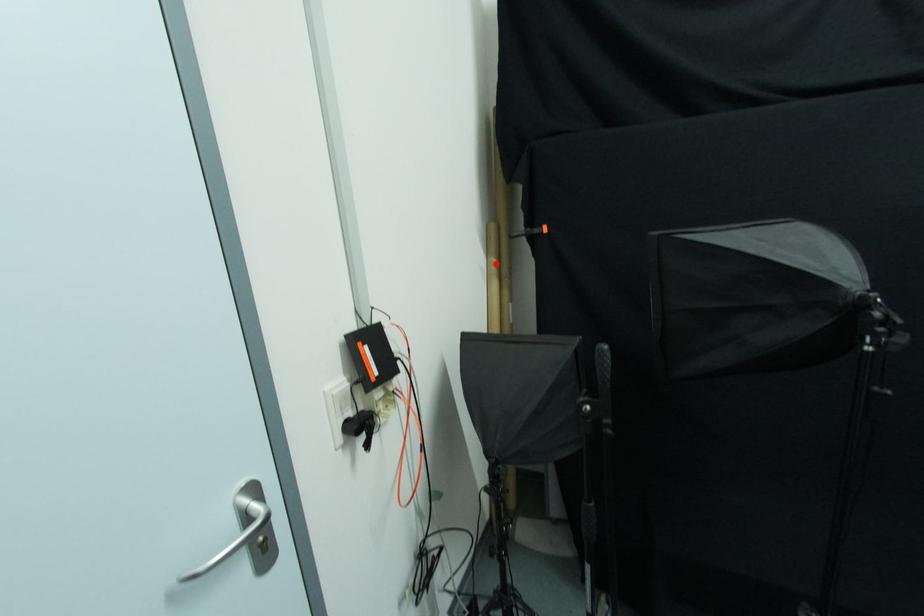
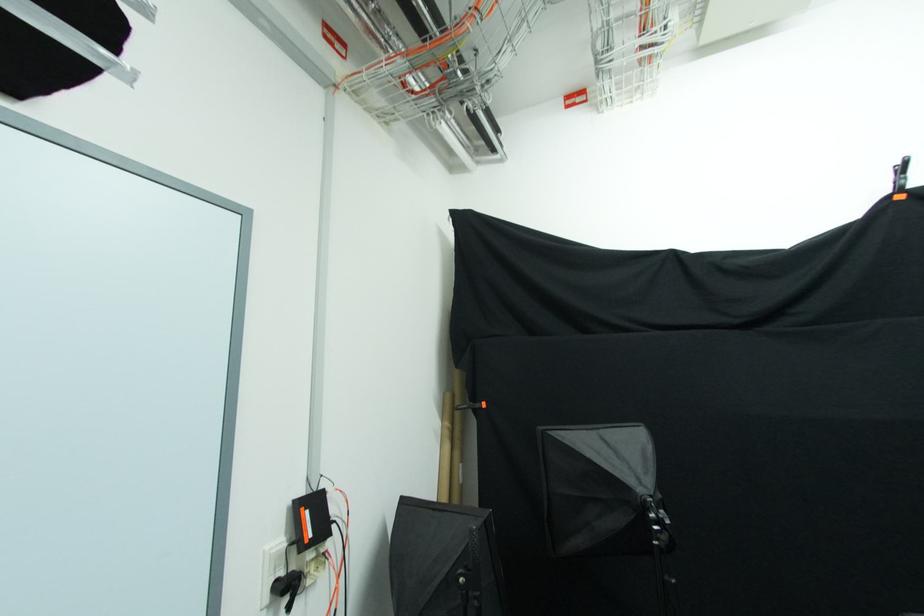
The point at the highlighted location is marked in the first image. Where is the corresponding point in the second image?

(448, 427)